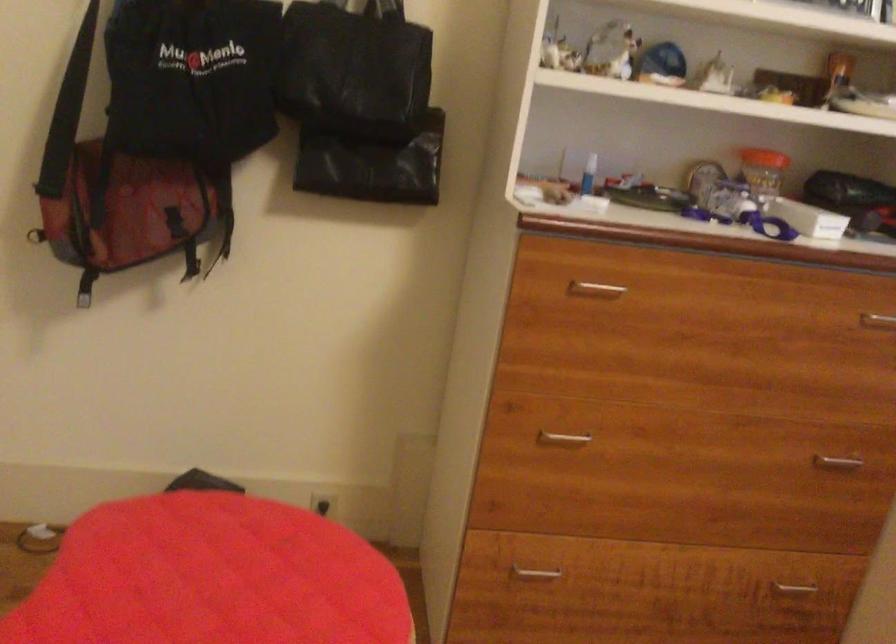
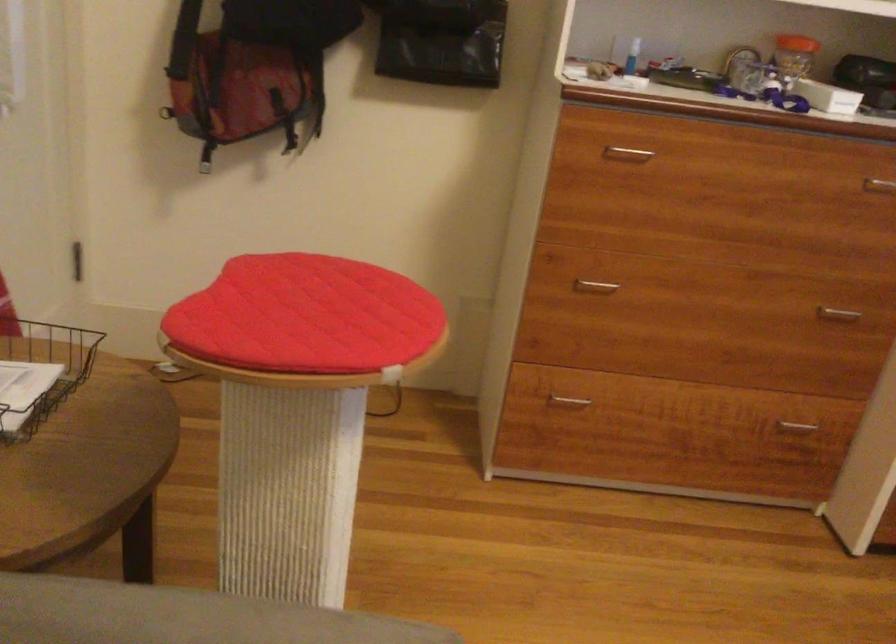
The point at (595,289) is marked in the first image. Where is the corresponding point in the second image?

(626, 154)